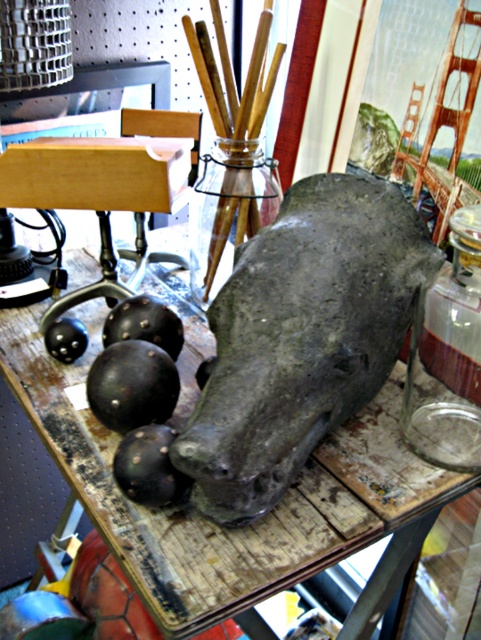
Question: Is matte gray stone pig at center to the right of transparent glass bottle at right from the viewer's perspective?

Choices:
 (A) no
 (B) yes

Answer: (A)

Question: Considering the real-world distances, which object is closest to the rusty wood table at center?

Choices:
 (A) transparent glass bottle at right
 (B) matte gray stone pig at center

Answer: (B)

Question: Which of the following is the closest to the observer?

Choices:
 (A) (440, 419)
 (B) (74, 364)
 (C) (265, 209)

Answer: (A)

Question: Which of these objects is positioned farthest from the rusty wood table at center?

Choices:
 (A) transparent glass jar at center
 (B) matte gray stone pig at center
 (C) transparent glass bottle at right

Answer: (A)

Question: Can you confirm if transparent glass bottle at right is thinner than transparent glass jar at center?

Choices:
 (A) yes
 (B) no

Answer: (A)

Question: Does matte gray stone pig at center come behind transparent glass jar at center?

Choices:
 (A) yes
 (B) no

Answer: (B)